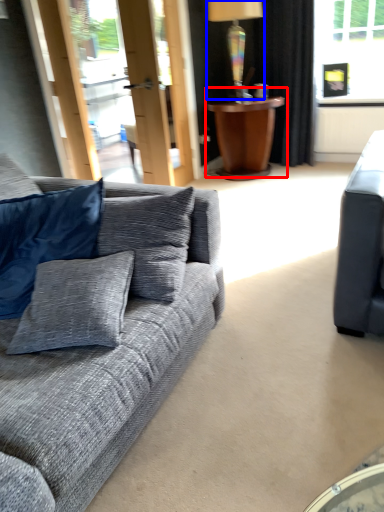
Question: Among these objects, which one is nearest to the camera, table (highlighted by a red box) or lamp (highlighted by a blue box)?

Choices:
 (A) table
 (B) lamp

Answer: (B)